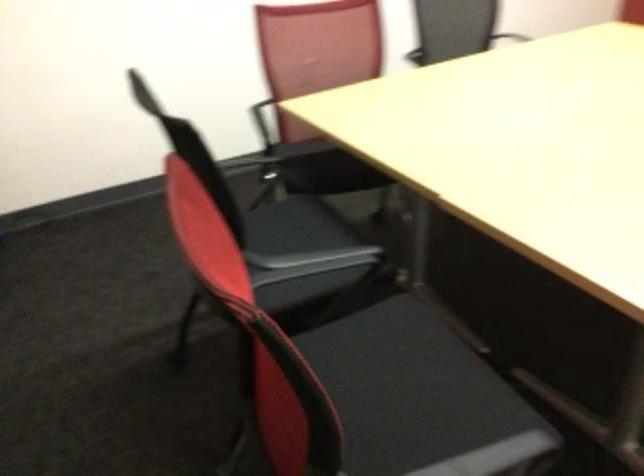
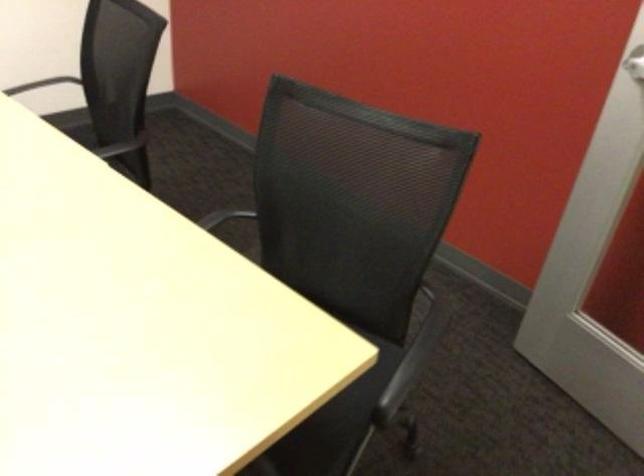
Question: The images are taken continuously from a first-person perspective. In which direction are you moving?

Choices:
 (A) Left
 (B) Right
 (C) Forward
 (D) Backward

Answer: (B)